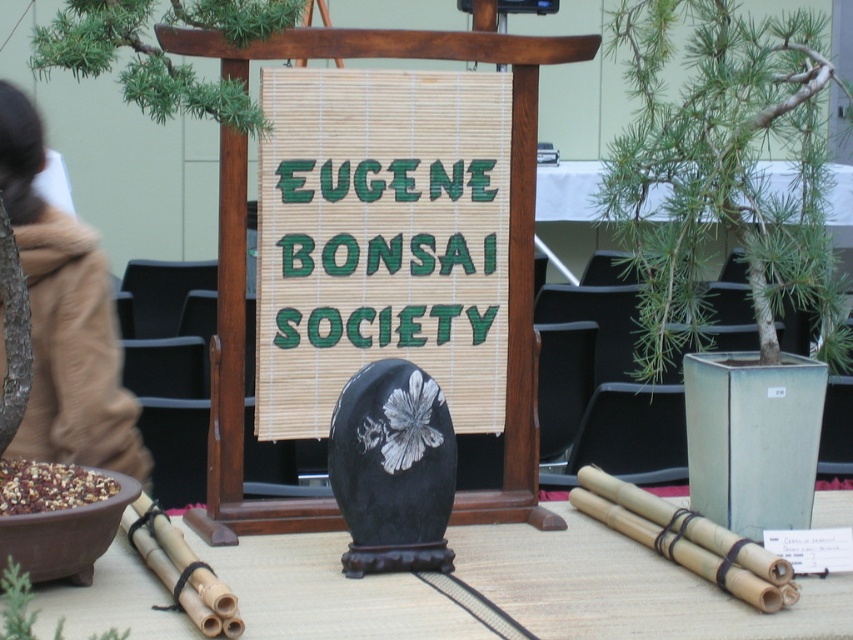
Measure the distance between green leafy bonsai at right and green leafy tree at upper left.

green leafy bonsai at right is 4.01 feet from green leafy tree at upper left.

Does green leafy bonsai at right have a lesser height compared to green leafy tree at upper left?

No, green leafy bonsai at right is not shorter than green leafy tree at upper left.

In order to click on green leafy bonsai at right in this screenshot , I will do coord(723,170).

Can you confirm if smooth bamboo sticks at center is positioned below green matte bamboo at lower left?

Yes, smooth bamboo sticks at center is below green matte bamboo at lower left.

Does smooth bamboo sticks at center have a lesser height compared to green matte bamboo at lower left?

Correct, smooth bamboo sticks at center is not as tall as green matte bamboo at lower left.

Which is in front, point (281, 584) or point (3, 632)?

Point (3, 632)

Identify the location of smooth bamboo sticks at center. This screenshot has height=640, width=853. (625, 588).

Where is `green leafy tree at upper left`? The height and width of the screenshot is (640, 853). green leafy tree at upper left is located at coordinates (137, 64).

Which is in front, point (206, 3) or point (33, 616)?

Positioned in front is point (33, 616).

This screenshot has width=853, height=640. What are the coordinates of `green leafy tree at upper left` in the screenshot? It's located at (137, 64).